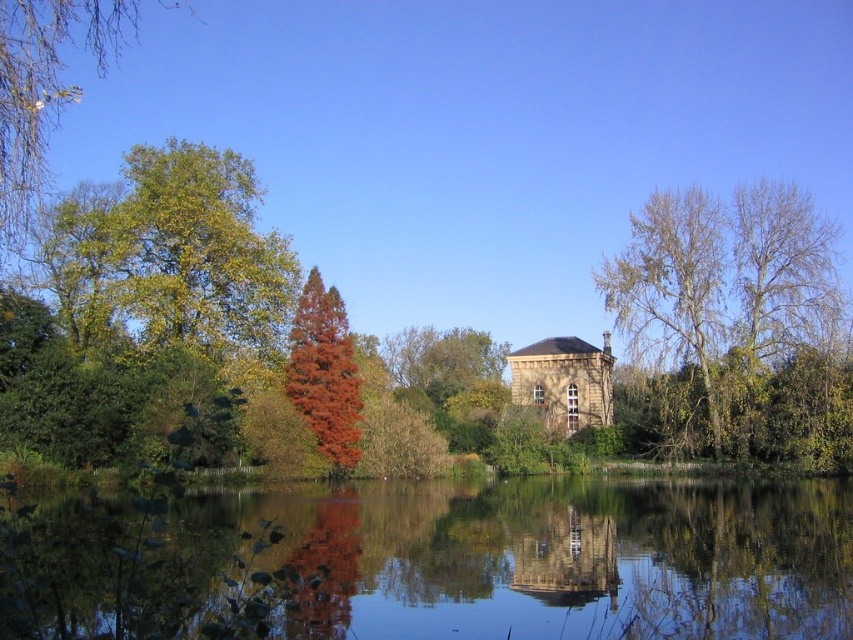
You are a landscape architect designing a path around the pond. The path must be wide enough to accommodate two people walking side by side. Given that the transparent water at center is wider than the smooth stone tower at center, can you determine if the pond is wide enough for the path?

The transparent water at center is wider than the smooth stone tower at center. Since the path needs to be wide enough for two people, and the water is wider, it should be sufficient. However, the exact width isn